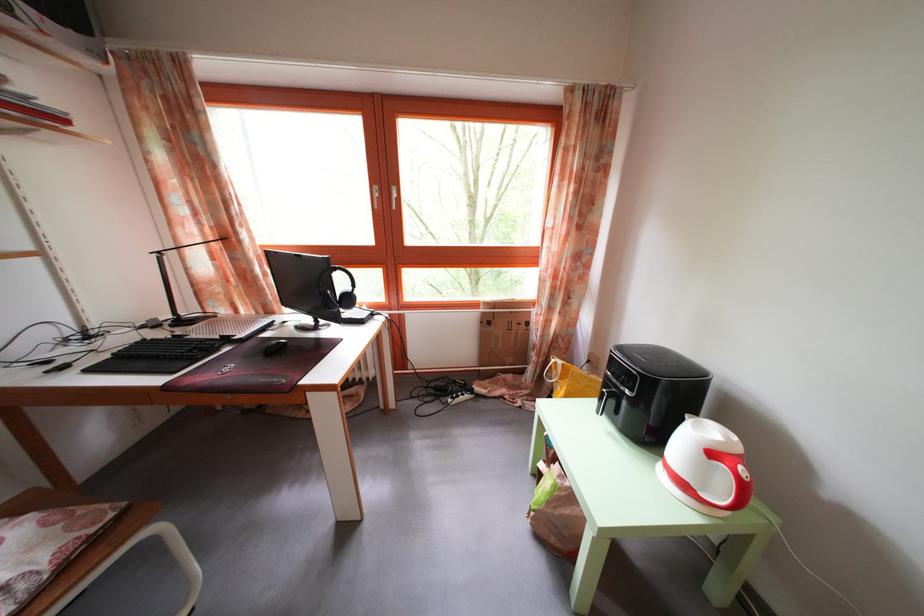
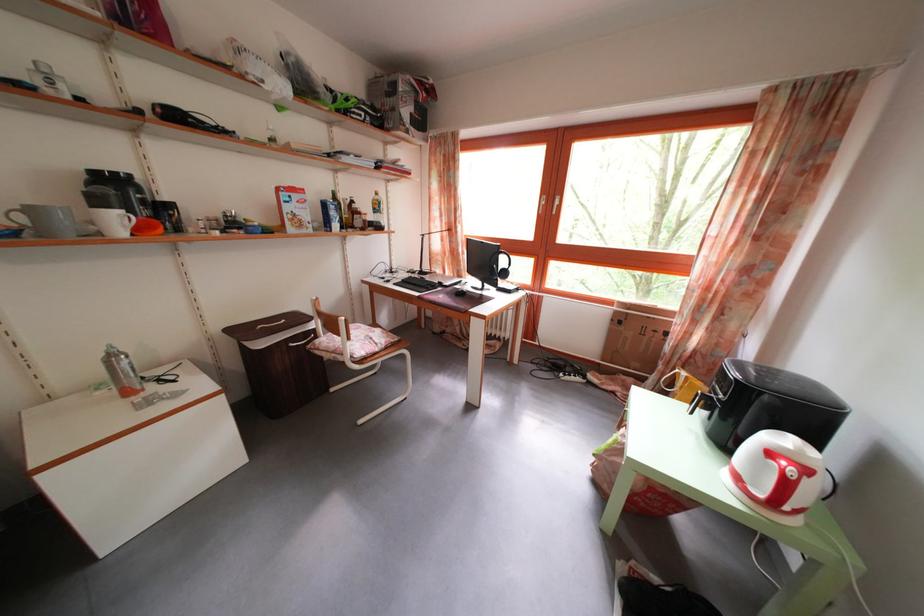
The point at (315, 286) is marked in the first image. Where is the corresponding point in the second image?

(492, 265)